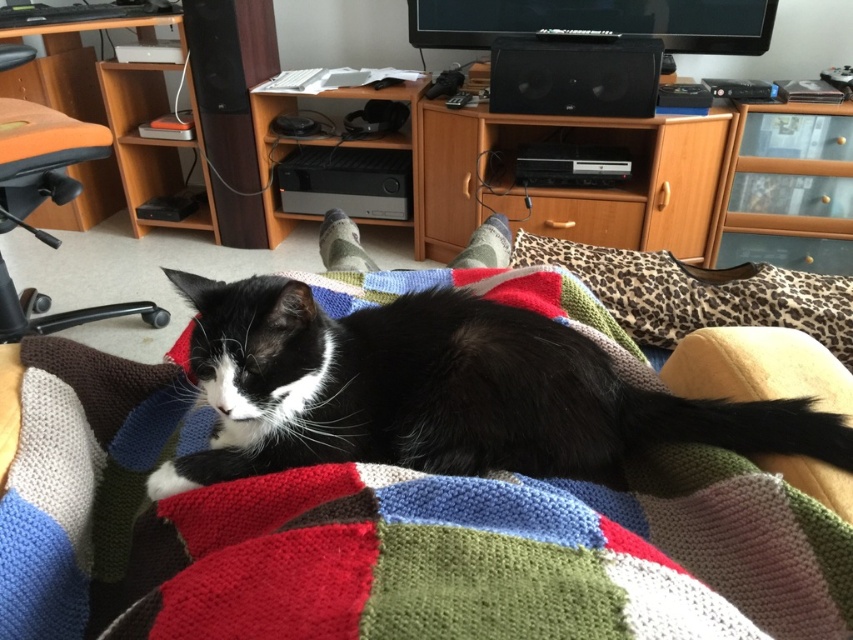
Does leopard print fabric pillow at lower right appear on the left side of orange wood computer desk at left?

In fact, leopard print fabric pillow at lower right is to the right of orange wood computer desk at left.

Can you confirm if leopard print fabric pillow at lower right is smaller than orange wood computer desk at left?

Yes, leopard print fabric pillow at lower right is smaller than orange wood computer desk at left.

Does point (627, 330) lie in front of point (154, 17)?

That is True.

Where is `leopard print fabric pillow at lower right`? The height and width of the screenshot is (640, 853). leopard print fabric pillow at lower right is located at coordinates (698, 292).

Which is more to the left, wooden cabinet at center or orange fabric computer chair at left?

Positioned to the left is orange fabric computer chair at left.

Does point (608, 138) come farther from viewer compared to point (4, 99)?

Yes, point (608, 138) is behind point (4, 99).

The width and height of the screenshot is (853, 640). Find the location of `wooden cabinet at center`. wooden cabinet at center is located at coordinates tap(573, 188).

Does orange wood computer desk at left appear on the right side of orange fabric computer chair at left?

Incorrect, orange wood computer desk at left is not on the right side of orange fabric computer chair at left.

Who is more forward, (126, 204) or (21, 298)?

Point (21, 298) is in front.

Who is more forward, (131, 92) or (49, 321)?

Point (49, 321)

Locate an element on the screen. orange wood computer desk at left is located at coordinates (149, 141).